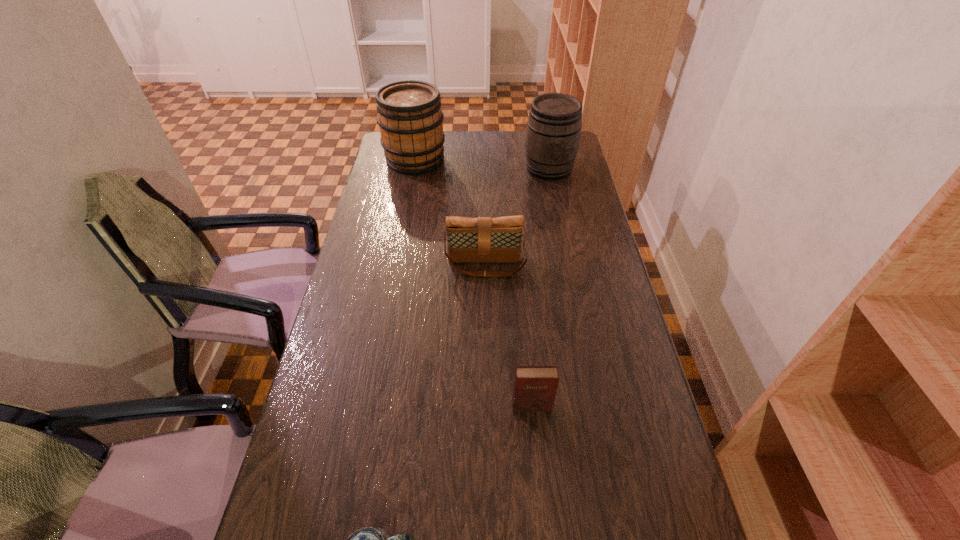
The height and width of the screenshot is (540, 960). In order to click on cider at the far edge in this screenshot , I will do pos(411,122).

The width and height of the screenshot is (960, 540). Find the location of `wine bucket located at the far edge`. wine bucket located at the far edge is located at coordinates (553, 132).

Image resolution: width=960 pixels, height=540 pixels. Identify the location of object situated at the left edge. (411, 122).

At what (x,y) coordinates should I click in order to perform the action: click on object located at the right edge. Please return your answer as a coordinate pair (x, y). Image resolution: width=960 pixels, height=540 pixels. Looking at the image, I should click on (553, 132).

Identify the location of object positioned at the far left corner. The width and height of the screenshot is (960, 540). (411, 122).

Image resolution: width=960 pixels, height=540 pixels. What are the coordinates of `object located at the far right corner` in the screenshot? It's located at (553, 132).

The image size is (960, 540). In the image, there is a desktop. Identify the location of vacant space at the far edge. [451, 140].

This screenshot has width=960, height=540. Identify the location of vacant area at the left edge of the desktop. (348, 372).

The image size is (960, 540). I want to click on vacant space at the right edge of the desktop, so click(x=634, y=343).

Locate an element on the screen. The width and height of the screenshot is (960, 540). empty location between the wine bucket and the cider is located at coordinates (482, 164).